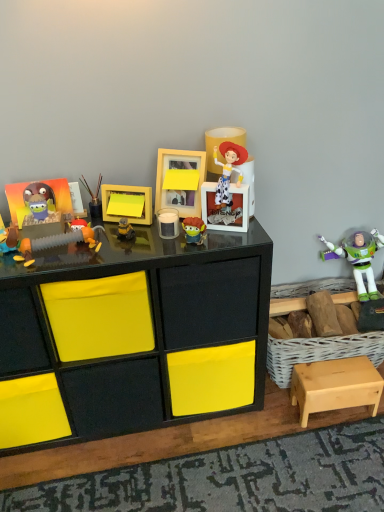
The image size is (384, 512). I want to click on free space in front of matte plastic toy at left, the 7th toy positioned from the right, so click(x=17, y=266).